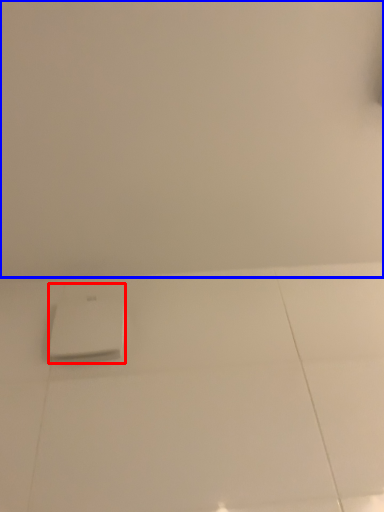
Question: Which point is further to the camera, home appliance (highlighted by a red box) or backdrop (highlighted by a blue box)?

Choices:
 (A) home appliance
 (B) backdrop

Answer: (A)